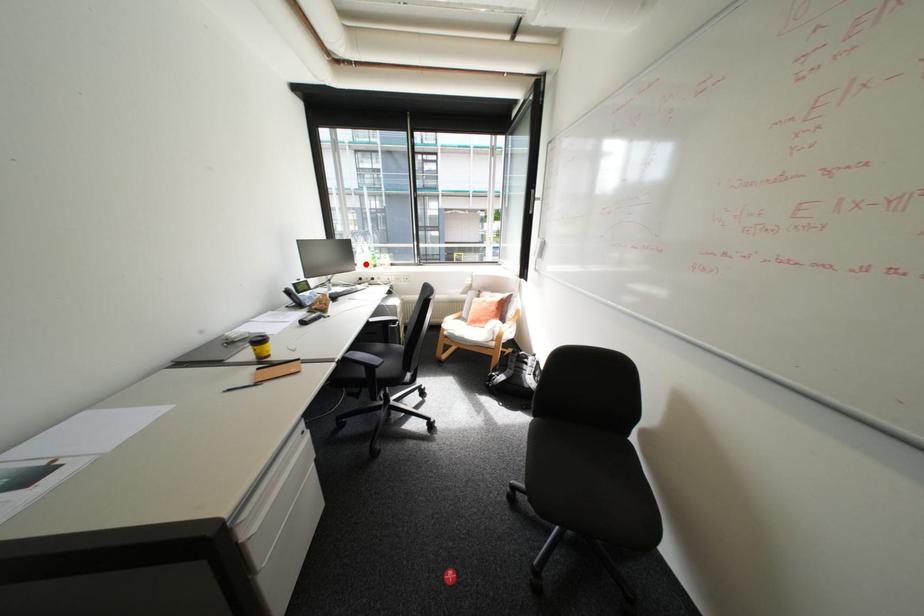
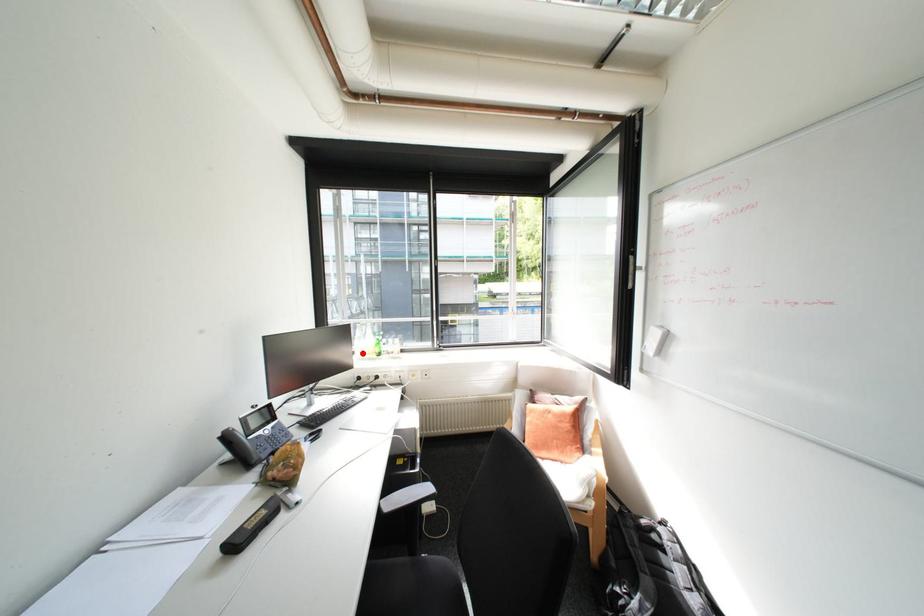
I am providing you with two images of the same scene from different viewpoints. A red point is marked on the first image and another point is marked on the second image. Does the point marked in image1 correspond to the same location as the one in image2?

Yes